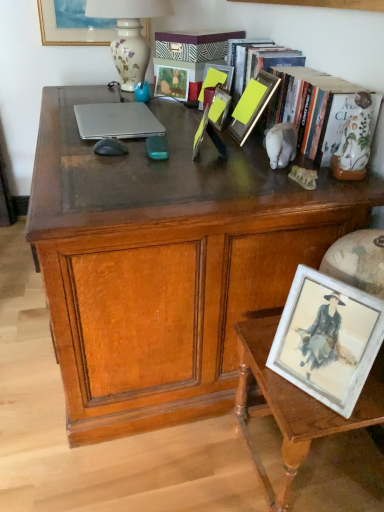
The width and height of the screenshot is (384, 512). Find the location of `free space in front of hardcover book at upper right`. free space in front of hardcover book at upper right is located at coordinates (231, 183).